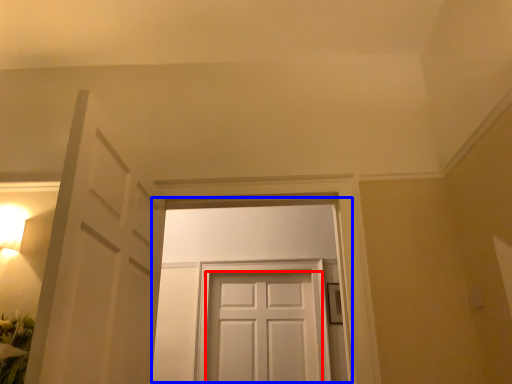
Question: Which of the following is the farthest to the observer, door (highlighted by a red box) or door (highlighted by a blue box)?

Choices:
 (A) door
 (B) door

Answer: (A)